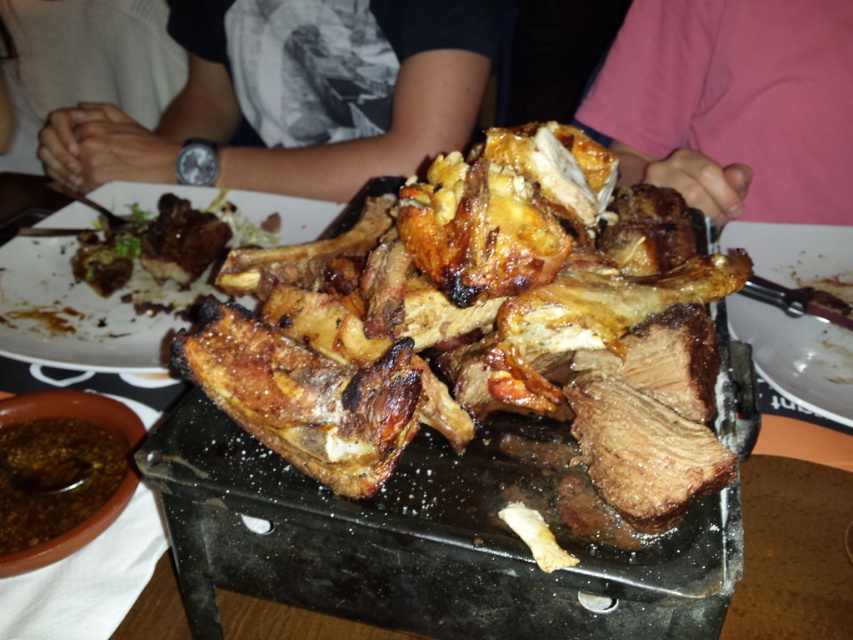
Question: Considering the relative positions of brown crispy ribs at center and black printed shirt at upper center in the image provided, where is brown crispy ribs at center located with respect to black printed shirt at upper center?

Choices:
 (A) left
 (B) right

Answer: (B)

Question: Estimate the real-world distances between objects in this image. Which object is farther from the slightly charred bone at center?

Choices:
 (A) brown glossy sauce at lower left
 (B) brown crispy ribs at center
 (C) black printed shirt at upper center
 (D) pink fabric at upper right

Answer: (D)

Question: Is black printed shirt at upper center above pink fabric at upper right?

Choices:
 (A) yes
 (B) no

Answer: (A)

Question: From the image, what is the correct spatial relationship of pink fabric at upper right in relation to slightly charred bone at center?

Choices:
 (A) below
 (B) above

Answer: (B)

Question: Considering the real-world distances, which object is closest to the slightly charred bone at center?

Choices:
 (A) brown glossy sauce at lower left
 (B) brown crispy ribs at center

Answer: (A)

Question: Which of the following is the farthest from the observer?

Choices:
 (A) (35, 474)
 (B) (33, 268)

Answer: (B)